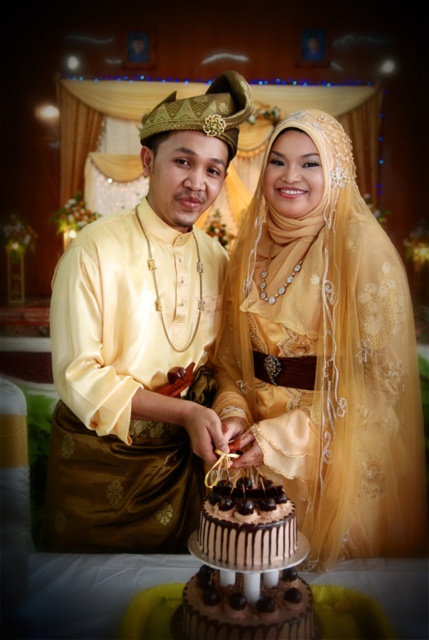
Question: Does satin yellow shirt at center have a greater width compared to chocolate frosted cake at center?

Choices:
 (A) no
 (B) yes

Answer: (B)

Question: Estimate the real-world distances between objects in this image. Which object is farther from the satin yellow shirt at center?

Choices:
 (A) chocolate glazed cake at center
 (B) chocolatesmoothcake at center
 (C) chocolate frosted cake at center

Answer: (B)

Question: Is matte gold dress at center below satin yellow shirt at center?

Choices:
 (A) yes
 (B) no

Answer: (A)

Question: Is matte gold dress at center smaller than chocolate glazed cake at center?

Choices:
 (A) yes
 (B) no

Answer: (B)

Question: Which point is farther to the camera?

Choices:
 (A) chocolate frosted cake at center
 (B) satin yellow shirt at center

Answer: (B)

Question: Which point is farther to the camera?

Choices:
 (A) (156, 259)
 (B) (404, 352)
 (C) (310, 621)

Answer: (A)